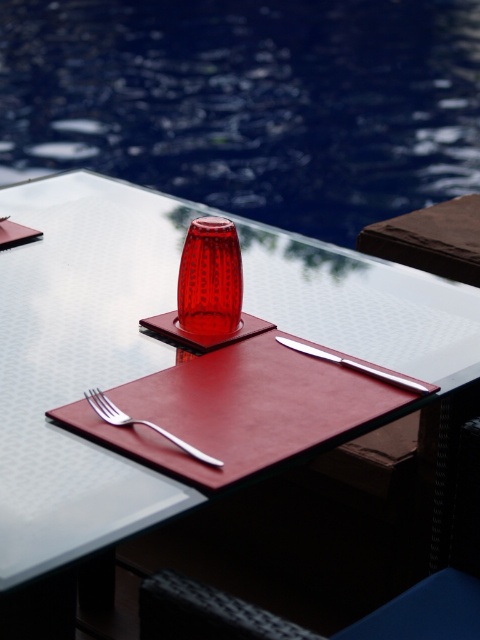
This screenshot has height=640, width=480. Describe the element at coordinates (80, 362) in the screenshot. I see `metallic silver knife at upper center` at that location.

Between point (67, 506) and point (391, 378), which one is positioned behind?

Positioned behind is point (391, 378).

Find the location of `metallic silver knife at upper center`. metallic silver knife at upper center is located at coordinates (80, 362).

The height and width of the screenshot is (640, 480). What are the coordinates of `metallic silver knife at upper center` in the screenshot? It's located at click(x=80, y=362).

Does point (37, 244) come in front of point (169, 436)?

No, (37, 244) is further to viewer.

Is point (48, 474) positioned behind point (155, 429)?

No, it is not.

This screenshot has height=640, width=480. What are the coordinates of `metallic silver knife at upper center` in the screenshot? It's located at tap(80, 362).

Does satin silver fork at lower left come behind polished metal knife at center?

No, it is not.

Is satin silver fork at lower left to the left of polished metal knife at center from the viewer's perspective?

Yes, satin silver fork at lower left is to the left of polished metal knife at center.

Does point (175, 442) come farther from viewer compared to point (296, 348)?

That is False.

The width and height of the screenshot is (480, 640). What are the coordinates of `satin silver fork at lower left` in the screenshot? It's located at (142, 424).